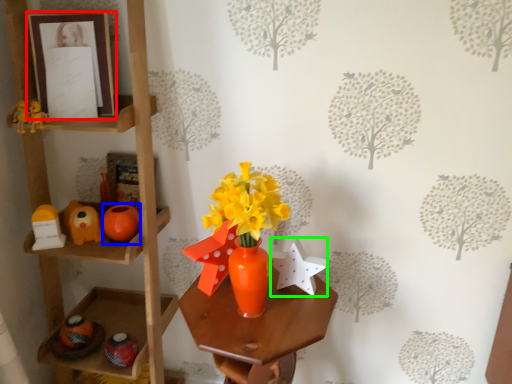
Question: Estimate the real-world distances between objects in this image. Which object is closer to picture frame (highlighted by a red box), toy (highlighted by a blue box) or toy (highlighted by a green box)?

Choices:
 (A) toy
 (B) toy

Answer: (A)